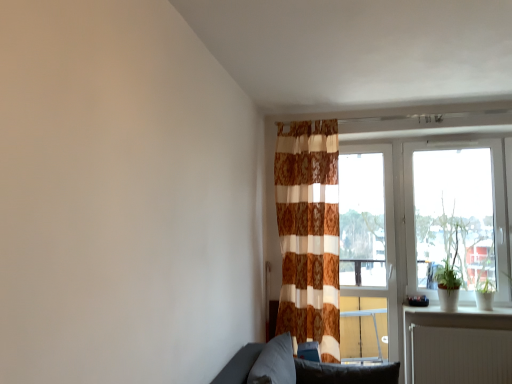
The image size is (512, 384). In order to click on free space above white glossy window sill at lower right (from a real-world perspective) in this screenshot , I will do `click(461, 309)`.